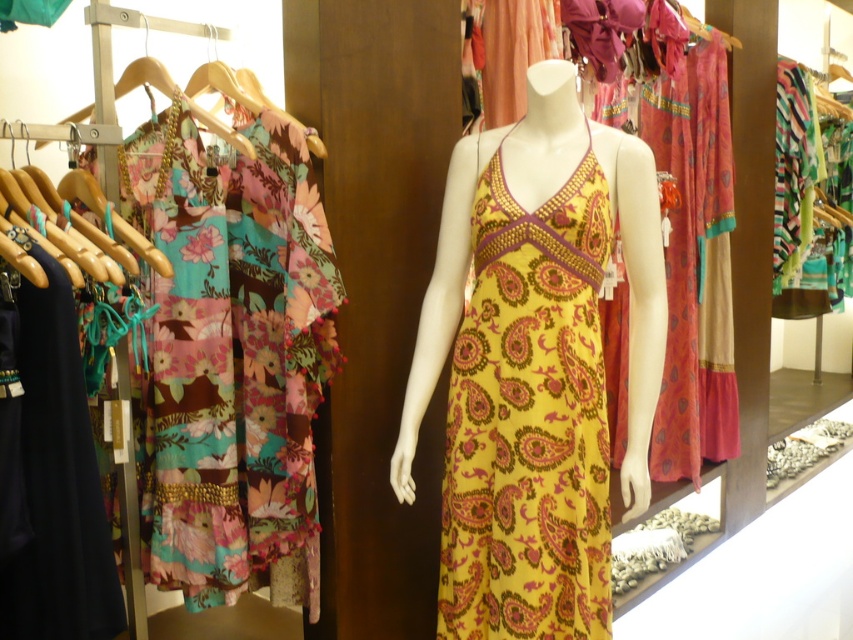
Can you confirm if yellow paisley fabric dress at center is positioned above wooden hanger at upper left?

Actually, yellow paisley fabric dress at center is below wooden hanger at upper left.

Who is shorter, yellow paisley fabric dress at center or wooden hanger at upper left?

Standing shorter between the two is wooden hanger at upper left.

Identify the location of yellow paisley fabric dress at center. This screenshot has width=853, height=640. (535, 365).